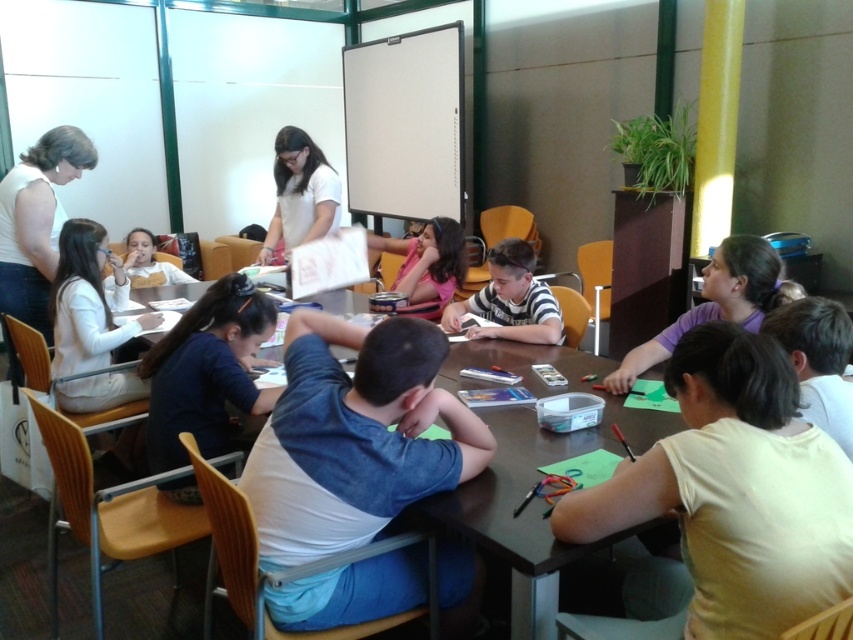
You are a student in the classroom and need to reach the brown wooden table at center from your current position near the white sleeveless top at upper left. Which direction should you move?

The brown wooden table at center is located below the white sleeveless top at upper left, so you should move downward to reach it.

You are standing at the entrance of the classroom and see the point marked at coordinates (355, 436). What object is located at that point?

The point at coordinates (355, 436) corresponds to the blue denim shirt at center.